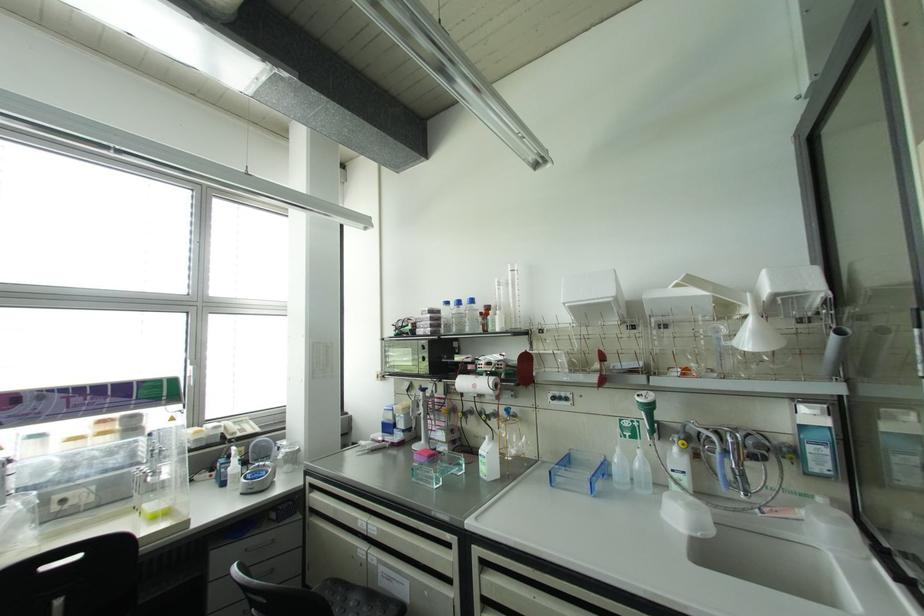
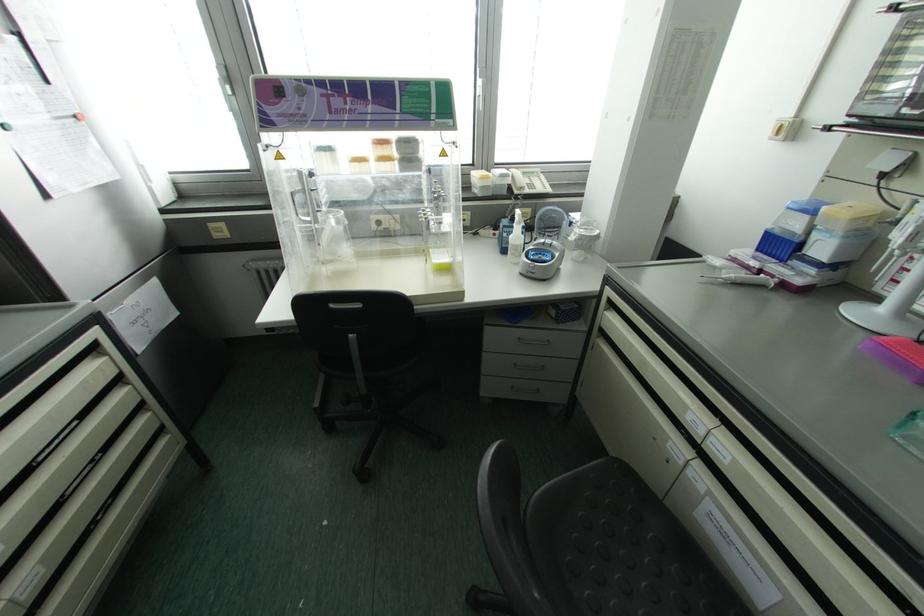
Where in the second image is the point corresponding to [421,440] from the first image?

(881, 309)